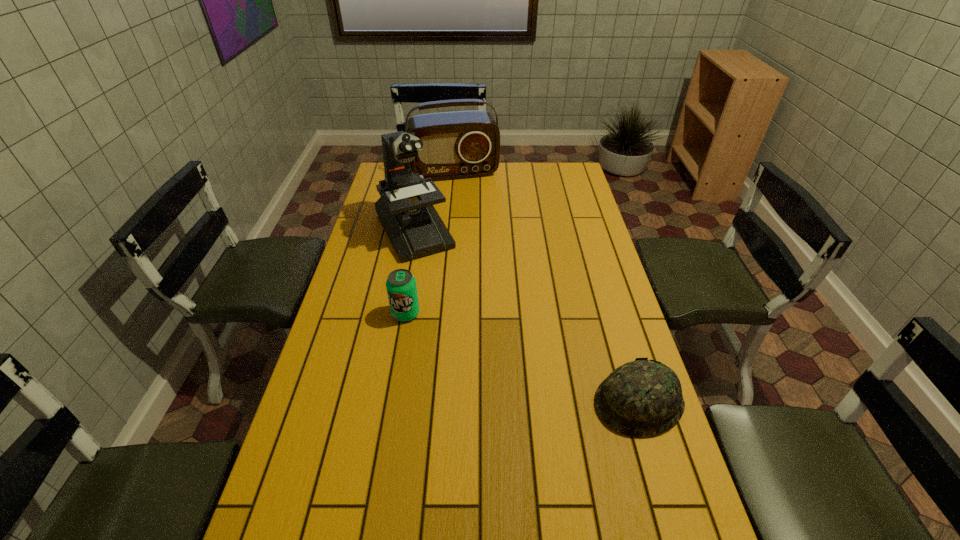
What are the coordinates of `vacant space on the desktop that is between the third tallest object and the rightmost object and is positioned through the eyepieces of the third nearest object` in the screenshot? It's located at (482, 342).

Locate an element on the screen. This screenshot has width=960, height=540. vacant spot on the desktop that is between the pop soda and the rightmost object and is positioned on the front panel of the third shortest object is located at coordinates (504, 351).